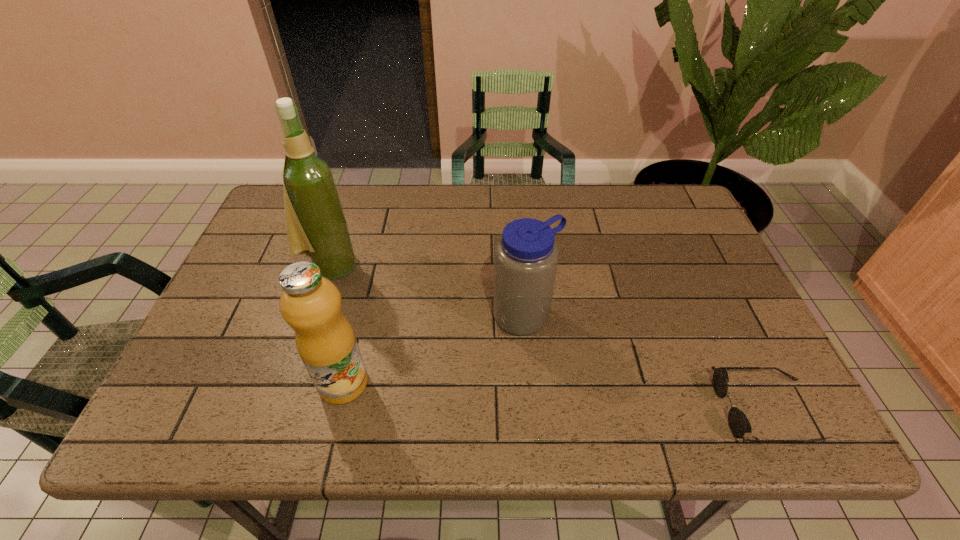
Locate an element on the screen. This screenshot has height=540, width=960. fruit juice is located at coordinates (311, 304).

Where is `the shortest object`? the shortest object is located at coordinates (739, 424).

Where is `sunglasses`? This screenshot has width=960, height=540. sunglasses is located at coordinates (739, 424).

This screenshot has width=960, height=540. I want to click on water bottle, so click(526, 257).

Locate an element on the screen. This screenshot has height=540, width=960. the second object from right to left is located at coordinates (526, 257).

Find the location of a particular element. the farthest object is located at coordinates (316, 225).

Where is `wine bottle`? This screenshot has width=960, height=540. wine bottle is located at coordinates (316, 225).

Locate an element on the screen. vacant space located on the front label of the third shortest object is located at coordinates (392, 383).

Locate an element on the screen. This screenshot has width=960, height=540. vacant space located 0.160m with a carrying loop on the side of the third tallest object is located at coordinates (588, 388).

Locate an element on the screen. This screenshot has width=960, height=540. vacant space located 0.060m with a carrying loop on the side of the third tallest object is located at coordinates (559, 354).